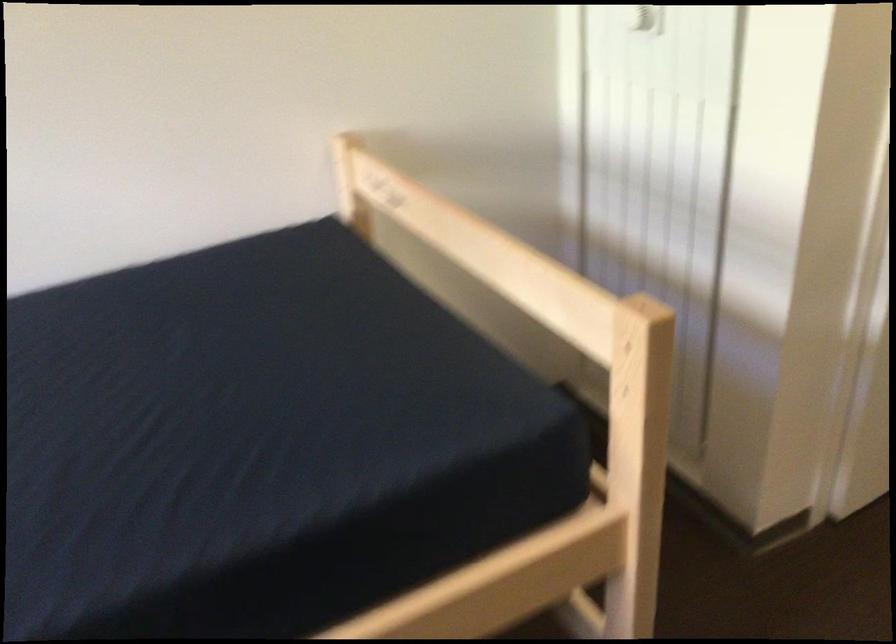
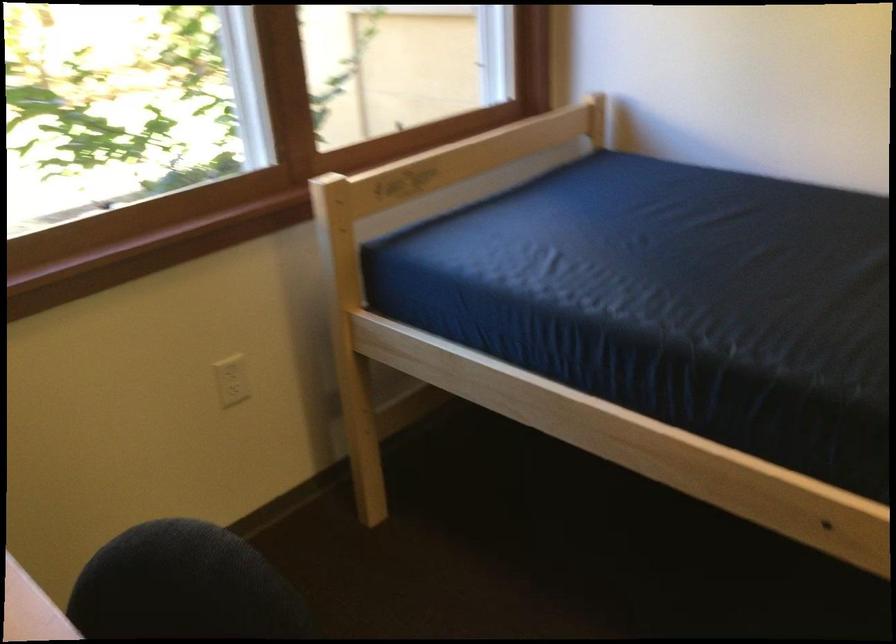
First-person continuous shooting, in which direction is the camera rotating?

The camera's rotation is toward left-down.